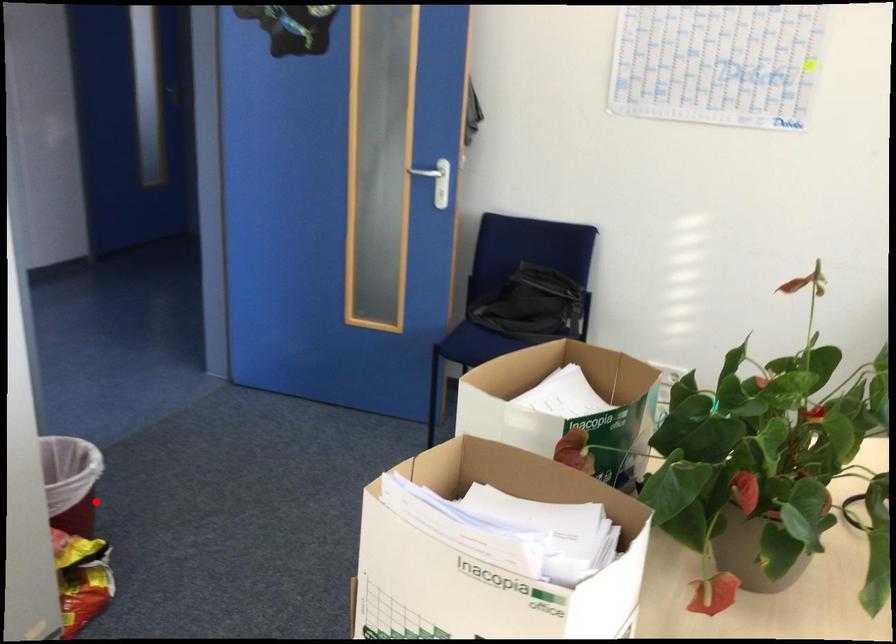
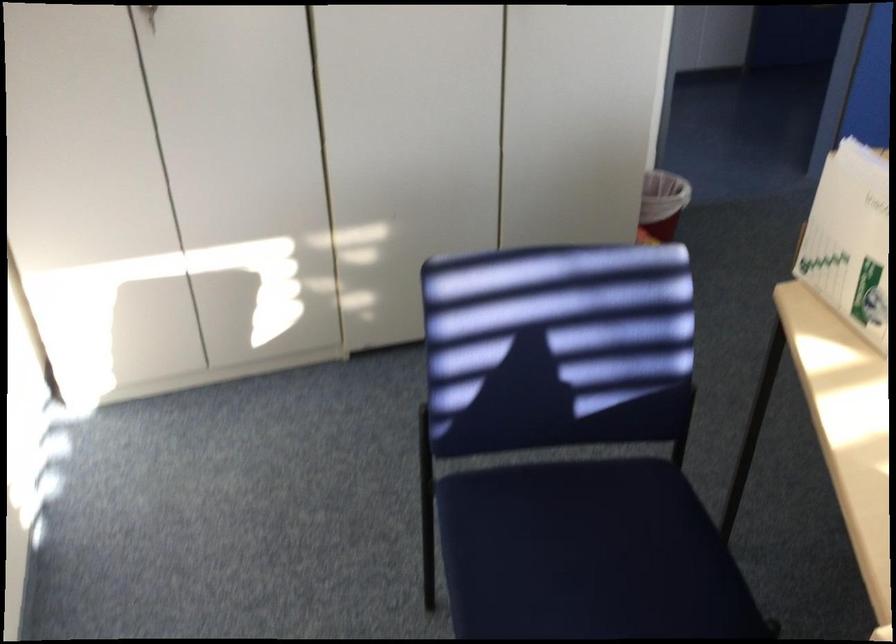
Question: A red point is marked in image1. In image2, is the corresponding 3D point closer to the camera or farther? Reply with the corresponding letter.

Choices:
 (A) The corresponding 3D point is closer.
 (B) The corresponding 3D point is farther.

Answer: (B)